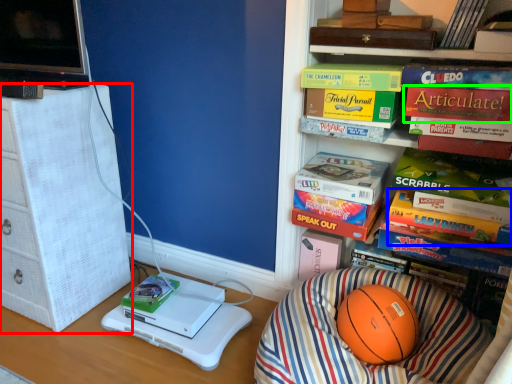
Question: Which object is the farthest from furniture (highlighted by a red box)? Choose among these: paperback book (highlighted by a blue box) or paperback book (highlighted by a green box).

Choices:
 (A) paperback book
 (B) paperback book

Answer: (B)